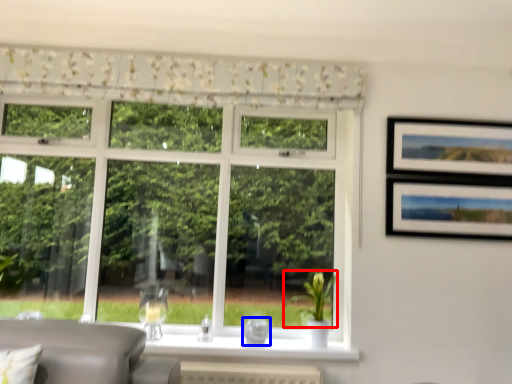
Question: Which object appears closest to the camera in this image, plant (highlighted by a red box) or glass vase (highlighted by a blue box)?

Choices:
 (A) plant
 (B) glass vase

Answer: (A)